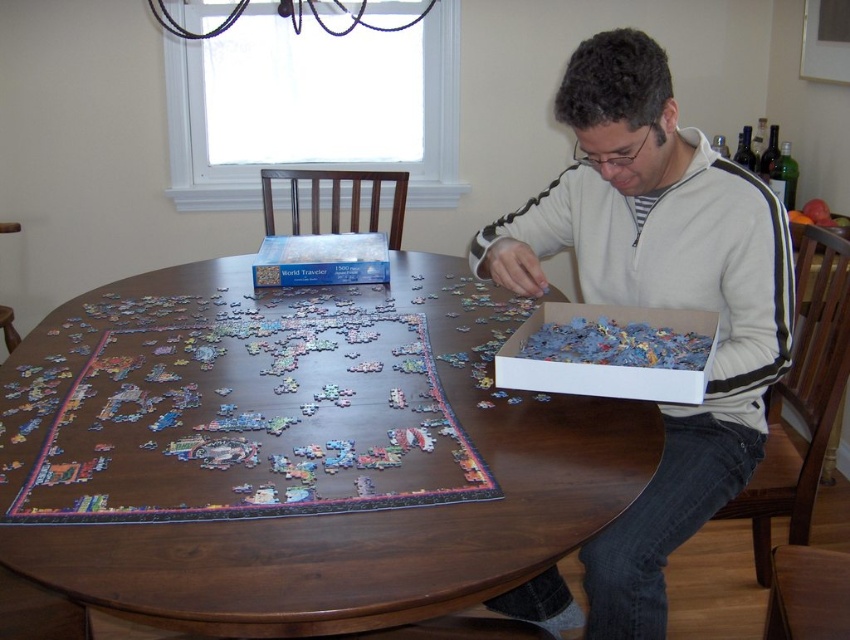
Question: Which of these objects is positioned closest to the dark wood round table at center?

Choices:
 (A) multicolored paper puzzle at center
 (B) white cardboard box at lower right
 (C) white fleece sweater at center

Answer: (A)

Question: In this image, where is dark wood round table at center located relative to multicolored paper puzzle at center?

Choices:
 (A) above
 (B) below

Answer: (A)

Question: Where is dark wood round table at center located in relation to white cardboard box at lower right in the image?

Choices:
 (A) above
 (B) below

Answer: (B)

Question: In this image, where is multicolored paper puzzle at center located relative to white cardboard box at lower right?

Choices:
 (A) below
 (B) above

Answer: (A)

Question: Among these objects, which one is farthest from the camera?

Choices:
 (A) white cardboard box at lower right
 (B) white fleece sweater at center
 (C) dark wood round table at center

Answer: (A)

Question: Based on their relative distances, which object is farther from the white fleece sweater at center?

Choices:
 (A) white cardboard box at lower right
 (B) dark wood round table at center

Answer: (B)